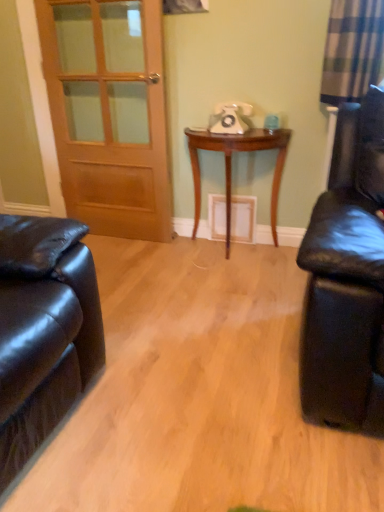
Question: From a real-world perspective, is wooden door at left beneath woodenmaterial/texturetable at center?

Choices:
 (A) yes
 (B) no

Answer: (B)

Question: Is wooden door at left turned away from woodenmaterial/texturetable at center?

Choices:
 (A) yes
 (B) no

Answer: (B)

Question: Are wooden door at left and woodenmaterial/texturetable at center far apart?

Choices:
 (A) no
 (B) yes

Answer: (A)

Question: Is wooden door at left beside woodenmaterial/texturetable at center?

Choices:
 (A) no
 (B) yes

Answer: (A)

Question: Does wooden door at left have a smaller size compared to woodenmaterial/texturetable at center?

Choices:
 (A) yes
 (B) no

Answer: (A)

Question: From the image's perspective, is wooden door at left above woodenmaterial/texturetable at center?

Choices:
 (A) no
 (B) yes

Answer: (B)

Question: Is woodenmaterial/texturetable at center wider than wooden door at left?

Choices:
 (A) no
 (B) yes

Answer: (B)

Question: From a real-world perspective, is woodenmaterial/texturetable at center positioned over wooden door at left based on gravity?

Choices:
 (A) no
 (B) yes

Answer: (A)

Question: Can you see woodenmaterial/texturetable at center touching wooden door at left?

Choices:
 (A) no
 (B) yes

Answer: (A)

Question: Would you say wooden door at left is part of woodenmaterial/texturetable at center's contents?

Choices:
 (A) no
 (B) yes

Answer: (A)

Question: Is woodenmaterial/texturetable at center outside wooden door at left?

Choices:
 (A) no
 (B) yes

Answer: (B)

Question: Is woodenmaterial/texturetable at center looking in the opposite direction of wooden door at left?

Choices:
 (A) yes
 (B) no

Answer: (B)

Question: Is wooden door at left spatially inside woodenmaterial/texturetable at center, or outside of it?

Choices:
 (A) inside
 (B) outside

Answer: (B)